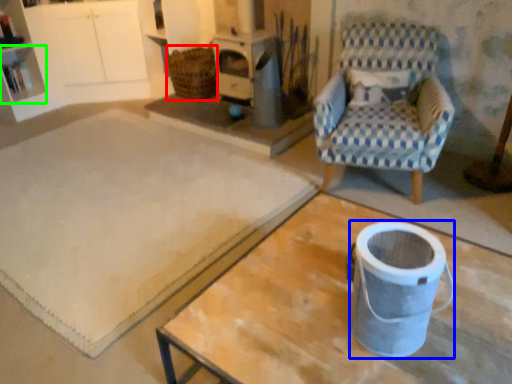
Question: Based on their relative distances, which object is farther from basket (highlighted by a red box)? Choose from appliance (highlighted by a blue box) and shelf (highlighted by a green box).

Choices:
 (A) appliance
 (B) shelf

Answer: (A)